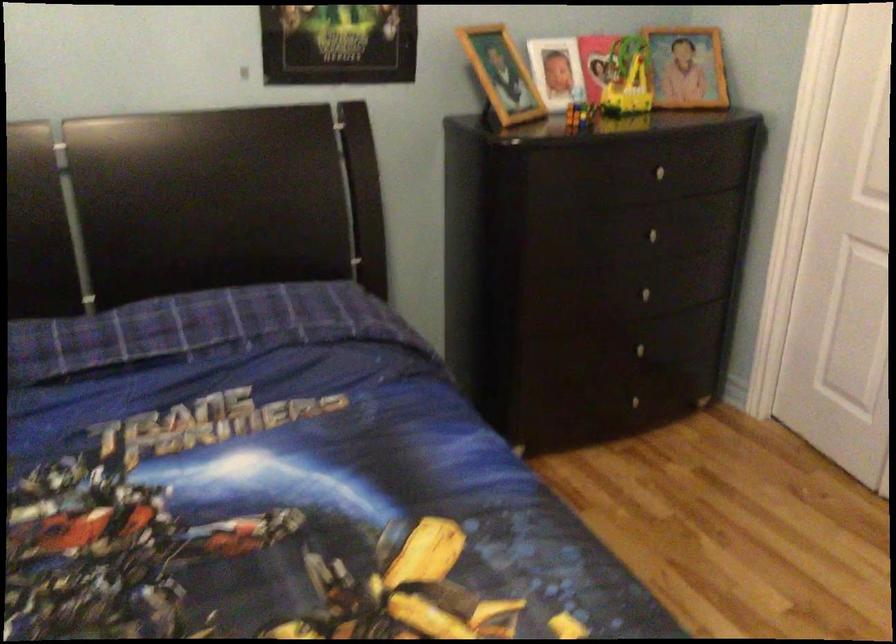
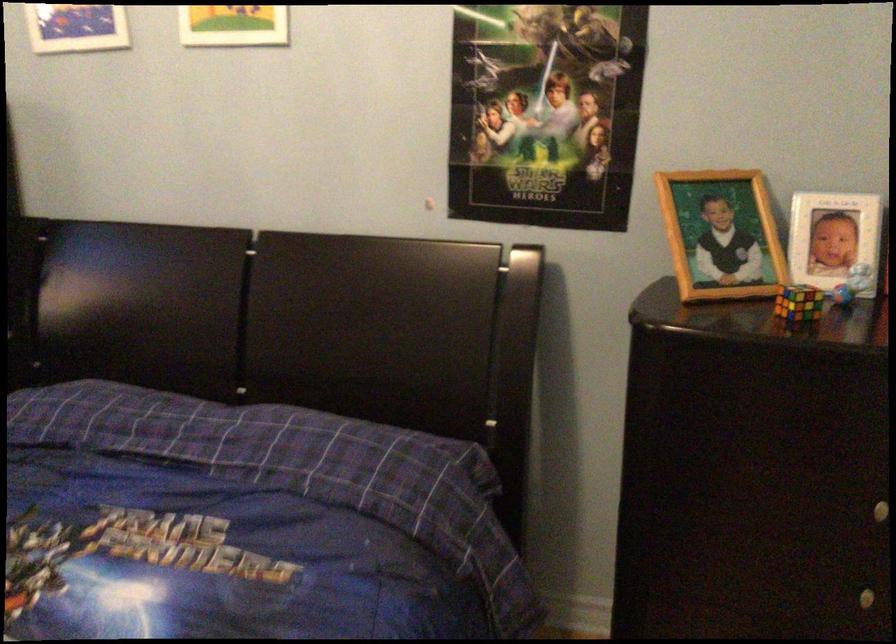
The point at (x=578, y=96) is marked in the first image. Where is the corresponding point in the second image?

(851, 283)